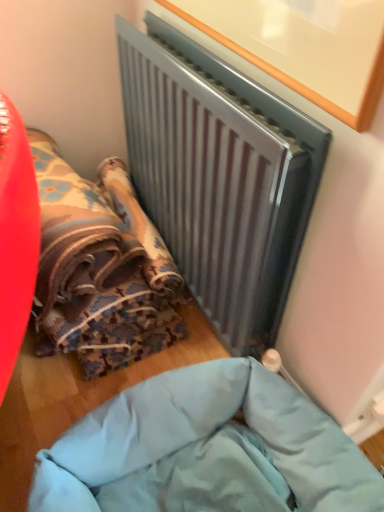
Question: From a real-world perspective, is light blue fabric at lower center positioned over metallic gray radiator at upper center based on gravity?

Choices:
 (A) no
 (B) yes

Answer: (A)

Question: From the image's perspective, does light blue fabric at lower center appear lower than metallic gray radiator at upper center?

Choices:
 (A) no
 (B) yes

Answer: (B)

Question: Is there a large distance between light blue fabric at lower center and metallic gray radiator at upper center?

Choices:
 (A) yes
 (B) no

Answer: (B)

Question: From the image's perspective, is light blue fabric at lower center on metallic gray radiator at upper center?

Choices:
 (A) yes
 (B) no

Answer: (B)

Question: Does light blue fabric at lower center have a greater height compared to metallic gray radiator at upper center?

Choices:
 (A) no
 (B) yes

Answer: (A)

Question: Is light blue fabric at lower center wider than metallic gray radiator at upper center?

Choices:
 (A) no
 (B) yes

Answer: (B)

Question: Can you confirm if light blue fabric at lower center is wider than textured fabric bean bag at lower left?

Choices:
 (A) no
 (B) yes

Answer: (B)

Question: Considering the relative sizes of light blue fabric at lower center and textured fabric bean bag at lower left in the image provided, is light blue fabric at lower center taller than textured fabric bean bag at lower left?

Choices:
 (A) yes
 (B) no

Answer: (B)

Question: Is light blue fabric at lower center far away from textured fabric bean bag at lower left?

Choices:
 (A) no
 (B) yes

Answer: (A)

Question: Could textured fabric bean bag at lower left be considered to be inside light blue fabric at lower center?

Choices:
 (A) yes
 (B) no

Answer: (B)

Question: Is light blue fabric at lower center looking in the opposite direction of textured fabric bean bag at lower left?

Choices:
 (A) no
 (B) yes

Answer: (A)

Question: Does light blue fabric at lower center have a lesser width compared to textured fabric bean bag at lower left?

Choices:
 (A) yes
 (B) no

Answer: (B)

Question: Is metallic gray radiator at upper center outside textured fabric bean bag at lower left?

Choices:
 (A) yes
 (B) no

Answer: (A)